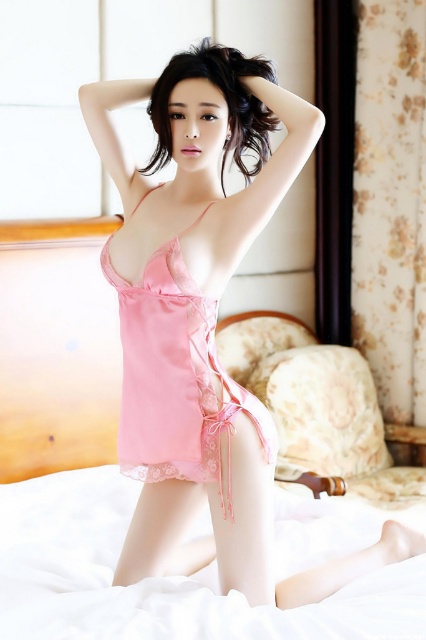
Question: Is matte pink lingerie at center positioned in front of pink satin dress at center?

Choices:
 (A) no
 (B) yes

Answer: (B)

Question: Among these points, which one is farthest from the camera?

Choices:
 (A) click(x=282, y=608)
 (B) click(x=150, y=259)
 (C) click(x=167, y=93)

Answer: (A)

Question: Which of the following is the closest to the observer?

Choices:
 (A) matte pink lingerie at center
 (B) pink satin dress at center
 (C) sleek black hair at upper center

Answer: (C)

Question: Is pink satin dress at center positioned at the back of sleek black hair at upper center?

Choices:
 (A) no
 (B) yes

Answer: (B)

Question: Can you confirm if pink satin dress at center is positioned to the right of sleek black hair at upper center?

Choices:
 (A) no
 (B) yes

Answer: (A)

Question: Considering the real-world distances, which object is closest to the pink satin dress at center?

Choices:
 (A) sleek black hair at upper center
 (B) matte pink lingerie at center

Answer: (B)